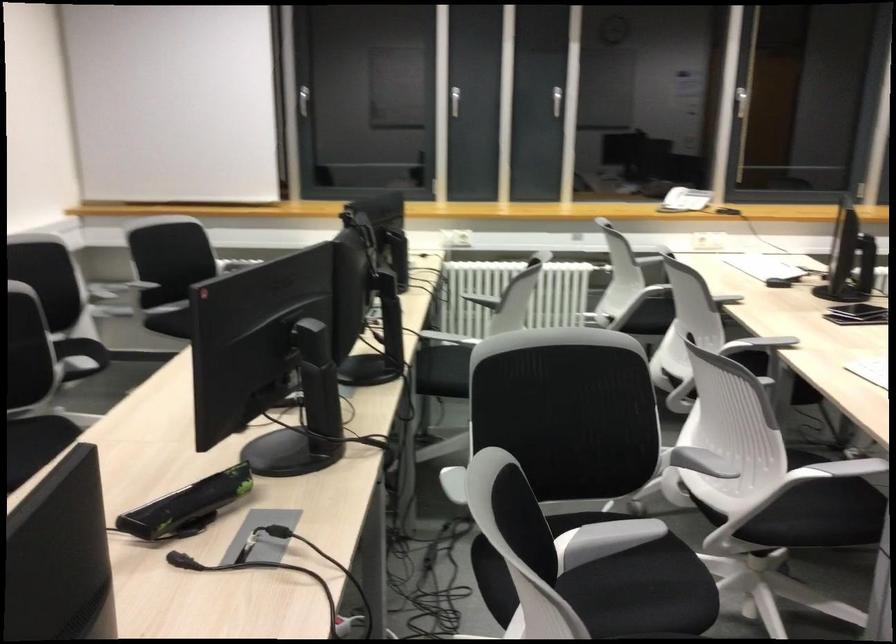
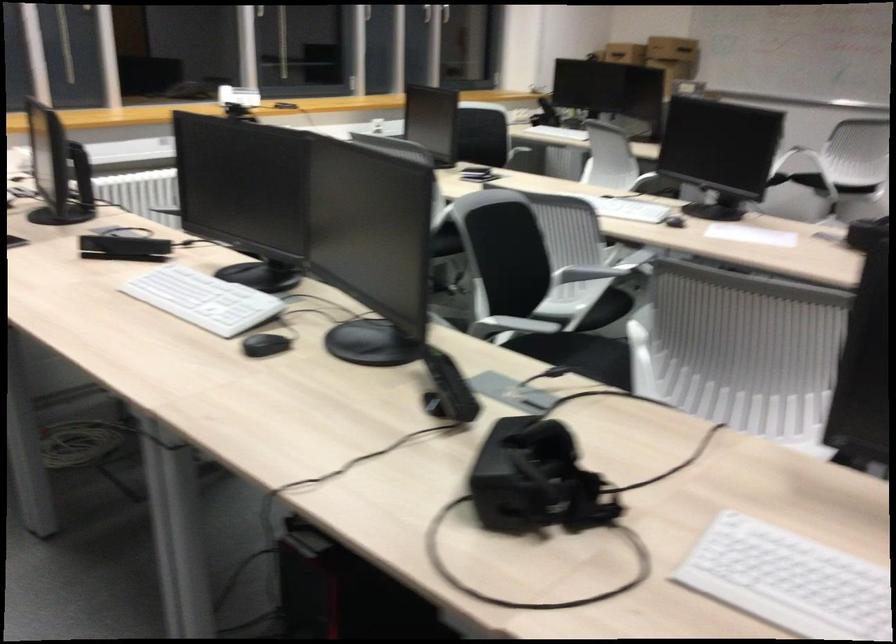
Locate, in the second image, the point that corresponds to [691,458] in the first image.

(586, 272)